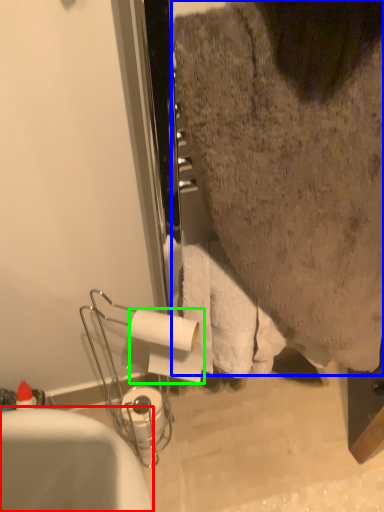
Question: Estimate the real-world distances between objects in this image. Which object is farther from bathtub (highlighted by a red box), person (highlighted by a blue box) or toilet paper (highlighted by a green box)?

Choices:
 (A) person
 (B) toilet paper

Answer: (A)